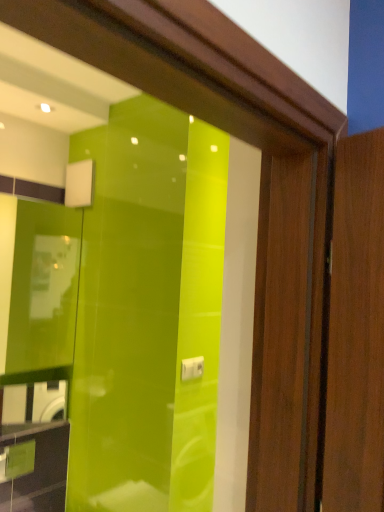
In the scene shown: In order to face white plastic electric outlet at center, should I rotate leftwards or rightwards?

You should rotate right by 0.225 degrees.

Describe the element at coordinates (192, 368) in the screenshot. Image resolution: width=384 pixels, height=512 pixels. I see `white plastic electric outlet at center` at that location.

Image resolution: width=384 pixels, height=512 pixels. I want to click on white plastic electric outlet at center, so click(192, 368).

Measure the distance between point (183, 371) and camera.

Point (183, 371) is 6.48 feet away from camera.

Image resolution: width=384 pixels, height=512 pixels. I want to click on white plastic electric outlet at center, so click(192, 368).